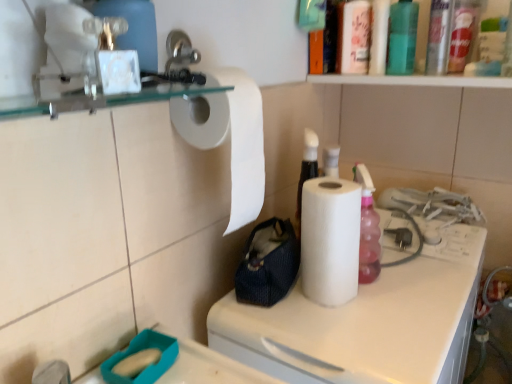
What is the approximate height of white matte paper towel at upper left, the second paper towel in the right-to-left sequence?

It is 14.36 inches.

In order to face green matte bottle at upper right, which ranks as the second bottle in front-to-back order, should I rotate leftwards or rightwards?

Turn right approximately 19.881 degrees to face it.

Describe the element at coordinates (366, 323) in the screenshot. This screenshot has height=384, width=512. I see `white matte paper towel at center` at that location.

What is the approximate width of navy blue fabric pouch at center?

The width of navy blue fabric pouch at center is 4.11 inches.

Image resolution: width=512 pixels, height=384 pixels. Describe the element at coordinates (438, 37) in the screenshot. I see `translucent plastic bottle at upper right, the second bottle in the back-to-front sequence` at that location.

Find the location of a particular element. white matte paper towel at upper left, the second paper towel in the right-to-left sequence is located at coordinates (231, 136).

Is the position of navy blue fabric pouch at center more distant than that of green matte bottle at upper right, which ranks as the second bottle in front-to-back order?

No, it is not.

Is navy blue fabric pouch at center inside the boundaries of green matte bottle at upper right, arranged as the first bottle when viewed from the back, or outside?

navy blue fabric pouch at center is located beyond the bounds of green matte bottle at upper right, arranged as the first bottle when viewed from the back.

Is navy blue fabric pouch at center positioned with its back to green matte bottle at upper right, which ranks as the second bottle in front-to-back order?

No.

Considering the positions of objects navy blue fabric pouch at center and green matte bottle at upper right, which ranks as the second bottle in front-to-back order, in the image provided, who is more to the left, navy blue fabric pouch at center or green matte bottle at upper right, which ranks as the second bottle in front-to-back order,?

Positioned to the left is navy blue fabric pouch at center.

Does point (341, 280) come in front of point (282, 269)?

Yes, point (341, 280) is in front of point (282, 269).

Who is bigger, white paper at center, acting as the first paper towel starting from the right, or navy blue fabric pouch at center?

Bigger between the two is white paper at center, acting as the first paper towel starting from the right.

Is white paper at center, acting as the first paper towel starting from the right, directly adjacent to navy blue fabric pouch at center?

Yes, white paper at center, acting as the first paper towel starting from the right, is beside navy blue fabric pouch at center.

Can you confirm if white paper at center, acting as the first paper towel starting from the right, is thinner than navy blue fabric pouch at center?

Correct, the width of white paper at center, acting as the first paper towel starting from the right, is less than that of navy blue fabric pouch at center.

Is point (184, 100) positioned in front of point (341, 213)?

Yes, point (184, 100) is closer to viewer.

Considering the sizes of white matte paper towel at upper left, which is counted as the 1th paper towel, starting from the left, and white paper at center, acting as the first paper towel starting from the right, in the image, is white matte paper towel at upper left, which is counted as the 1th paper towel, starting from the left, taller or shorter than white paper at center, acting as the first paper towel starting from the right,?

Considering their sizes, white matte paper towel at upper left, which is counted as the 1th paper towel, starting from the left, has more height than white paper at center, acting as the first paper towel starting from the right.

Find the location of `paper towel below the white matte paper towel at upper left, the second paper towel in the right-to-left sequence (from a real-world perspective)`. paper towel below the white matte paper towel at upper left, the second paper towel in the right-to-left sequence (from a real-world perspective) is located at coordinates 330,240.

Considering the points (324, 314) and (310, 183), which point is behind, point (324, 314) or point (310, 183)?

The point (310, 183) is more distant.

Can you confirm if white matte paper towel at center is positioned to the left of white paper at center, the 2th paper towel when ordered from left to right?

Incorrect, white matte paper towel at center is not on the left side of white paper at center, the 2th paper towel when ordered from left to right.

Is white matte paper towel at center positioned far away from white paper at center, the 2th paper towel when ordered from left to right?

Actually, white matte paper towel at center and white paper at center, the 2th paper towel when ordered from left to right, are a little close together.

Which of these two, green matte bottle at upper right, which ranks as the second bottle in front-to-back order, or white matte paper towel at upper left, the second paper towel in the right-to-left sequence, stands shorter?

With less height is green matte bottle at upper right, which ranks as the second bottle in front-to-back order.

Considering the sizes of objects green matte bottle at upper right, arranged as the first bottle when viewed from the back, and white matte paper towel at upper left, which is counted as the 1th paper towel, starting from the left, in the image provided, who is bigger, green matte bottle at upper right, arranged as the first bottle when viewed from the back, or white matte paper towel at upper left, which is counted as the 1th paper towel, starting from the left,?

Bigger between the two is white matte paper towel at upper left, which is counted as the 1th paper towel, starting from the left.

Is green matte bottle at upper right, which ranks as the second bottle in front-to-back order, oriented towards white matte paper towel at upper left, which is counted as the 1th paper towel, starting from the left?

No.

From the image's perspective, count 1st paper towels downward from the green matte bottle at upper right, which ranks as the second bottle in front-to-back order, and point to it. Please provide its 2D coordinates.

[(231, 136)]

Is white matte paper towel at center taller than navy blue fabric pouch at center?

Yes, white matte paper towel at center is taller than navy blue fabric pouch at center.

Considering the relative positions of white matte paper towel at center and navy blue fabric pouch at center in the image provided, is white matte paper towel at center to the left or to the right of navy blue fabric pouch at center?

white matte paper towel at center is positioned on navy blue fabric pouch at center's right side.

Would you say navy blue fabric pouch at center is part of white matte paper towel at center's contents?

Yes, white matte paper towel at center is surrounding navy blue fabric pouch at center.

Considering the sizes of objects navy blue fabric pouch at center and white matte paper towel at center in the image provided, who is thinner, navy blue fabric pouch at center or white matte paper towel at center?

With smaller width is navy blue fabric pouch at center.

Based on their positions, is navy blue fabric pouch at center located to the left or right of white matte paper towel at center?

navy blue fabric pouch at center is positioned on white matte paper towel at center's left side.

Looking at the image, does navy blue fabric pouch at center seem bigger or smaller compared to white matte paper towel at center?

navy blue fabric pouch at center is smaller than white matte paper towel at center.

This screenshot has width=512, height=384. In order to click on counter that appears below the navy blue fabric pouch at center (from a real-world perspective) in this screenshot , I will do `click(366, 323)`.

At what (x,y) coordinates should I click in order to perform the action: click on the 2nd bottle above when counting from the navy blue fabric pouch at center (from the image's perspective). Please return your answer as a coordinate pair (x, y). The width and height of the screenshot is (512, 384). Looking at the image, I should click on (402, 37).

This screenshot has height=384, width=512. Identify the location of paper towel lying on the right of navy blue fabric pouch at center. pyautogui.click(x=330, y=240).

Estimate the real-world distances between objects in this image. Which object is further from navy blue fabric pouch at center, translucent plastic bottle at upper right, the second bottle in the back-to-front sequence, or green matte bottle at upper right, arranged as the first bottle when viewed from the back?

The object further to navy blue fabric pouch at center is translucent plastic bottle at upper right, the second bottle in the back-to-front sequence.

Based on their spatial positions, is white matte paper towel at center or navy blue fabric pouch at center closer to white matte paper towel at upper left, the second paper towel in the right-to-left sequence?

Based on the image, navy blue fabric pouch at center appears to be nearer to white matte paper towel at upper left, the second paper towel in the right-to-left sequence.

Considering their positions, is navy blue fabric pouch at center positioned further to white matte paper towel at upper left, the second paper towel in the right-to-left sequence, than white paper at center, acting as the first paper towel starting from the right?

navy blue fabric pouch at center.

From the image, which object appears to be nearer to white paper at center, acting as the first paper towel starting from the right, white matte paper towel at upper left, which is counted as the 1th paper towel, starting from the left, or navy blue fabric pouch at center?

The object closer to white paper at center, acting as the first paper towel starting from the right, is navy blue fabric pouch at center.

Which object lies nearer to the anchor point white matte paper towel at center, white matte paper towel at upper left, the second paper towel in the right-to-left sequence, or navy blue fabric pouch at center?

Based on the image, navy blue fabric pouch at center appears to be nearer to white matte paper towel at center.

Based on the photo, when comparing their distances from navy blue fabric pouch at center, does white paper at center, the 2th paper towel when ordered from left to right, or translucent plastic bottle at upper right, the second bottle in the back-to-front sequence, seem closer?

Among the two, white paper at center, the 2th paper towel when ordered from left to right, is located nearer to navy blue fabric pouch at center.

Estimate the real-world distances between objects in this image. Which object is further from white matte paper towel at center, green matte bottle at upper right, which ranks as the second bottle in front-to-back order, or white paper at center, acting as the first paper towel starting from the right?

green matte bottle at upper right, which ranks as the second bottle in front-to-back order, is positioned further to the anchor white matte paper towel at center.

Consider the image. Looking at the image, which one is located closer to translucent plastic bottle at upper right, positioned as the first bottle in front-to-back order, white matte paper towel at upper left, the second paper towel in the right-to-left sequence, or navy blue fabric pouch at center?

white matte paper towel at upper left, the second paper towel in the right-to-left sequence, lies closer to translucent plastic bottle at upper right, positioned as the first bottle in front-to-back order, than the other object.

Where is `bottle between white matte paper towel at upper left, the second paper towel in the right-to-left sequence, and translucent plastic bottle at upper right, the second bottle in the back-to-front sequence, from left to right`? The height and width of the screenshot is (384, 512). bottle between white matte paper towel at upper left, the second paper towel in the right-to-left sequence, and translucent plastic bottle at upper right, the second bottle in the back-to-front sequence, from left to right is located at coordinates (402, 37).

Identify the location of pouch between green matte bottle at upper right, which ranks as the second bottle in front-to-back order, and white matte paper towel at center from top to bottom. This screenshot has width=512, height=384. (268, 264).

The image size is (512, 384). Find the location of `pouch between white paper at center, acting as the first paper towel starting from the right, and white matte paper towel at center from top to bottom`. pouch between white paper at center, acting as the first paper towel starting from the right, and white matte paper towel at center from top to bottom is located at coordinates pos(268,264).

Find the location of `pouch between translucent plastic bottle at upper right, the second bottle in the back-to-front sequence, and white matte paper towel at center, in the vertical direction`. pouch between translucent plastic bottle at upper right, the second bottle in the back-to-front sequence, and white matte paper towel at center, in the vertical direction is located at coordinates (268, 264).